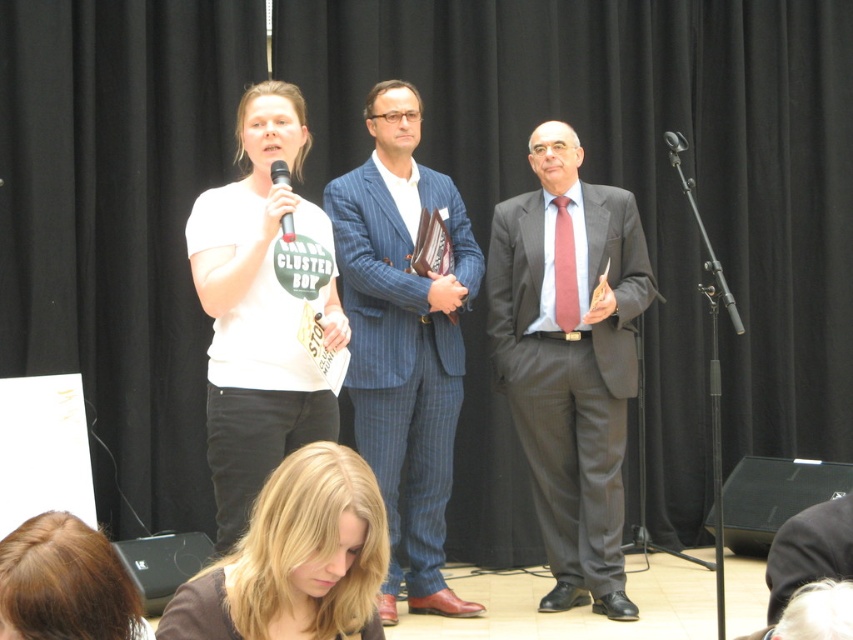
From the picture: You are standing at the back of the room and want to approach the stage. There is a 3 meter wide path leading to the stage. Can you walk directly from the matte gray suit at center to the blonde hair at lower left without crossing the path?

The matte gray suit at center is 2.94 meters away from the blonde hair at lower left. Since the path is 3 meters wide, you can walk directly between them without crossing the path as the distance between them is slightly less than the path width.